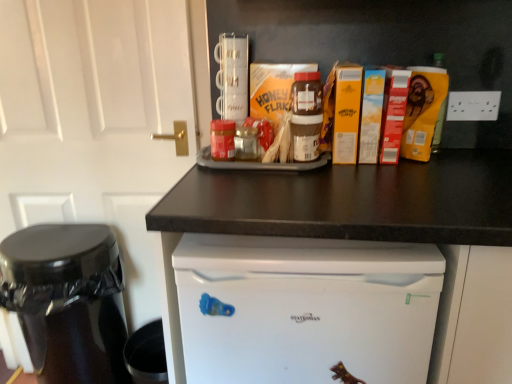
Describe the element at coordinates (473, 105) in the screenshot. The image size is (512, 384). I see `white plastic electric outlet at upper right` at that location.

Where is `shiny black coffee maker at left`? This screenshot has width=512, height=384. shiny black coffee maker at left is located at coordinates (67, 300).

Is shiny black coffee maker at left not within dark brown laminate counter at center?

That's correct, shiny black coffee maker at left is outside of dark brown laminate counter at center.

Considering the relative sizes of shiny black coffee maker at left and dark brown laminate counter at center in the image provided, is shiny black coffee maker at left wider than dark brown laminate counter at center?

No.

Could you tell me if shiny black coffee maker at left is facing dark brown laminate counter at center?

No, shiny black coffee maker at left does not turn towards dark brown laminate counter at center.

From a real-world perspective, is shiny black coffee maker at left on top of dark brown laminate counter at center?

No.

From a real-world perspective, is dark brown laminate counter at center over white plastic electric outlet at upper right?

Actually, dark brown laminate counter at center is physically below white plastic electric outlet at upper right in the real world.

From the image's perspective, between dark brown laminate counter at center and white plastic electric outlet at upper right, who is located below?

From the image's view, dark brown laminate counter at center is below.

Is dark brown laminate counter at center next to white plastic electric outlet at upper right?

No.

Is dark brown laminate counter at center wider or thinner than white plastic electric outlet at upper right?

Considering their sizes, dark brown laminate counter at center looks broader than white plastic electric outlet at upper right.

From a real-world perspective, is dark brown laminate counter at center physically located above or below white matte door at upper left?

From a real-world perspective, dark brown laminate counter at center is physically below white matte door at upper left.

Which object is closer to the camera taking this photo, dark brown laminate counter at center or white matte door at upper left?

dark brown laminate counter at center is in front.

Who is shorter, dark brown laminate counter at center or white matte door at upper left?

With less height is dark brown laminate counter at center.

Does dark brown laminate counter at center appear on the left side of white matte door at upper left?

No, dark brown laminate counter at center is not to the left of white matte door at upper left.

Would you say shiny black coffee maker at left is outside white matte door at upper left?

That's correct, shiny black coffee maker at left is outside of white matte door at upper left.

In the image, is shiny black coffee maker at left on the left side or the right side of white matte door at upper left?

In the image, shiny black coffee maker at left appears on the left side of white matte door at upper left.

What's the angular difference between shiny black coffee maker at left and white matte door at upper left's facing directions?

0.00127 degrees separate the facing orientations of shiny black coffee maker at left and white matte door at upper left.

Considering the relative positions of white matte door at upper left and shiny black coffee maker at left in the image provided, is white matte door at upper left to the left of shiny black coffee maker at left from the viewer's perspective?

No.

From the image's perspective, is white matte door at upper left above or below shiny black coffee maker at left?

From the image's perspective, white matte door at upper left appears above shiny black coffee maker at left.

Where is `door in front of the shiny black coffee maker at left`? door in front of the shiny black coffee maker at left is located at coordinates (95, 121).

Is white matte door at upper left directly adjacent to shiny black coffee maker at left?

white matte door at upper left and shiny black coffee maker at left are clearly separated.

Locate an element on the screen. electric outlet on the right of shiny black coffee maker at left is located at coordinates (473, 105).

Is shiny black coffee maker at left in contact with white plastic electric outlet at upper right?

No, shiny black coffee maker at left is not with white plastic electric outlet at upper right.

Can you tell me how much shiny black coffee maker at left and white plastic electric outlet at upper right differ in facing direction?

shiny black coffee maker at left and white plastic electric outlet at upper right are facing 2.86 degrees away from each other.

Can you see white plastic electric outlet at upper right touching dark brown laminate counter at center?

white plastic electric outlet at upper right and dark brown laminate counter at center are not in contact.

From their relative heights in the image, would you say white plastic electric outlet at upper right is taller or shorter than dark brown laminate counter at center?

In the image, white plastic electric outlet at upper right appears to be shorter than dark brown laminate counter at center.

Does white plastic electric outlet at upper right have a smaller size compared to dark brown laminate counter at center?

Indeed, white plastic electric outlet at upper right has a smaller size compared to dark brown laminate counter at center.

Which object is wider, white plastic electric outlet at upper right or dark brown laminate counter at center?

Wider between the two is dark brown laminate counter at center.

Where is `counter above the shiny black coffee maker at left (from the image's perspective)`? The height and width of the screenshot is (384, 512). counter above the shiny black coffee maker at left (from the image's perspective) is located at coordinates pyautogui.click(x=376, y=237).

Where is `counter in front of the white plastic electric outlet at upper right`? counter in front of the white plastic electric outlet at upper right is located at coordinates (376, 237).

From the image, which object appears to be nearer to white matte door at upper left, white plastic electric outlet at upper right or shiny black coffee maker at left?

shiny black coffee maker at left.

From the image, which object appears to be farther from shiny black coffee maker at left, white plastic electric outlet at upper right or white matte door at upper left?

Among the two, white plastic electric outlet at upper right is located further to shiny black coffee maker at left.

Considering their positions, is dark brown laminate counter at center positioned further to white plastic electric outlet at upper right than shiny black coffee maker at left?

The object further to white plastic electric outlet at upper right is shiny black coffee maker at left.

From the image, which object appears to be farther from white plastic electric outlet at upper right, shiny black coffee maker at left or white matte door at upper left?

Among the two, shiny black coffee maker at left is located further to white plastic electric outlet at upper right.

Which object lies further to the anchor point dark brown laminate counter at center, shiny black coffee maker at left or white matte door at upper left?

Among the two, shiny black coffee maker at left is located further to dark brown laminate counter at center.

Based on their spatial positions, is white plastic electric outlet at upper right or dark brown laminate counter at center closer to shiny black coffee maker at left?

Among the two, dark brown laminate counter at center is located nearer to shiny black coffee maker at left.

Based on the photo, which object lies nearer to the anchor point white matte door at upper left, shiny black coffee maker at left or white plastic electric outlet at upper right?

Based on the image, shiny black coffee maker at left appears to be nearer to white matte door at upper left.

Based on their spatial positions, is white matte door at upper left or white plastic electric outlet at upper right closer to dark brown laminate counter at center?

Based on the image, white plastic electric outlet at upper right appears to be nearer to dark brown laminate counter at center.

The height and width of the screenshot is (384, 512). I want to click on counter between shiny black coffee maker at left and white plastic electric outlet at upper right in the horizontal direction, so click(x=376, y=237).

The image size is (512, 384). Identify the location of counter between white matte door at upper left and white plastic electric outlet at upper right in the horizontal direction. (376, 237).

Locate an element on the screen. The height and width of the screenshot is (384, 512). door situated between shiny black coffee maker at left and dark brown laminate counter at center from left to right is located at coordinates (95, 121).

Identify the location of door between shiny black coffee maker at left and white plastic electric outlet at upper right from left to right. (95, 121).